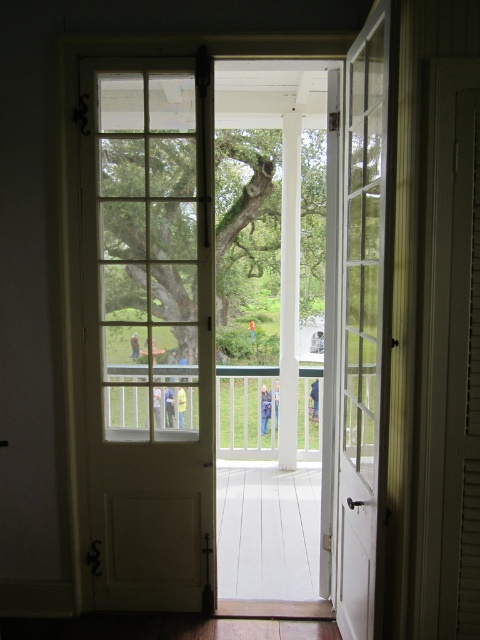
Question: Among these points, which one is farthest from the camera?

Choices:
 (A) tap(140, 365)
 (B) tap(351, 381)

Answer: (A)

Question: Can you confirm if white wood door at center is positioned below white glass door at center?

Choices:
 (A) yes
 (B) no

Answer: (B)

Question: Which of the following is the closest to the observer?

Choices:
 (A) (139, 176)
 (B) (382, 22)

Answer: (B)

Question: Can you confirm if white wood door at center is positioned to the left of white glass door at center?

Choices:
 (A) no
 (B) yes

Answer: (B)

Question: Which point appears closest to the camera in this image?

Choices:
 (A) (136, 74)
 (B) (355, 348)

Answer: (B)

Question: Can you confirm if white wood door at center is positioned to the right of white glass door at center?

Choices:
 (A) no
 (B) yes

Answer: (A)